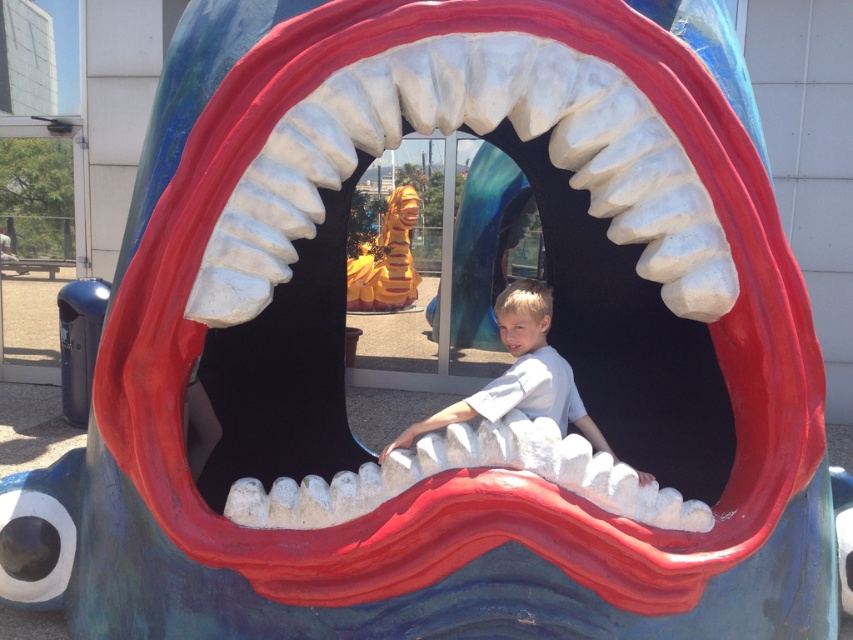
Can you confirm if light blue cotton shirt at center is positioned above gold metallic dragon at center?

Incorrect, light blue cotton shirt at center is not positioned above gold metallic dragon at center.

Is light blue cotton shirt at center closer to the viewer compared to gold metallic dragon at center?

Yes, it is.

Which is in front, point (479, 404) or point (349, 280)?

Point (479, 404)

You are a GUI agent. You are given a task and a screenshot of the screen. Output one action in this format:
    pyautogui.click(x=<x>, y=<y>)
    Task: Click on the light blue cotton shirt at center
    Image resolution: width=853 pixels, height=640 pixels.
    Given the screenshot: What is the action you would take?
    pyautogui.click(x=519, y=376)

Based on the photo, which is more to the left, light blue cotton shirt at center or white matte teeth at center?

A: light blue cotton shirt at center

Does light blue cotton shirt at center come in front of white matte teeth at center?

Yes, light blue cotton shirt at center is in front of white matte teeth at center.

The width and height of the screenshot is (853, 640). What do you see at coordinates (519, 376) in the screenshot? I see `light blue cotton shirt at center` at bounding box center [519, 376].

At what (x,y) coordinates should I click in order to perform the action: click on light blue cotton shirt at center. Please return your answer as a coordinate pair (x, y). The width and height of the screenshot is (853, 640). Looking at the image, I should click on (519, 376).

Who is higher up, gold metallic dragon at center or white matte teeth at center?

gold metallic dragon at center is above.

Is gold metallic dragon at center above white matte teeth at center?

Yes, gold metallic dragon at center is above white matte teeth at center.

I want to click on gold metallic dragon at center, so click(x=386, y=259).